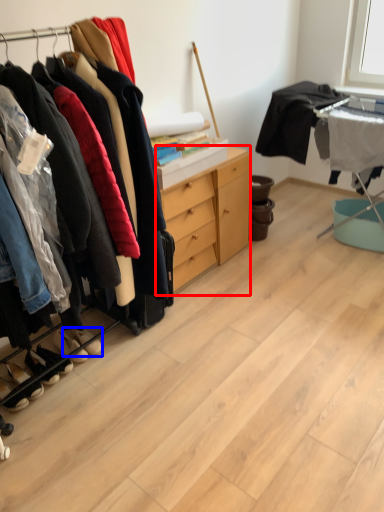
Question: Which point is closer to the camera, cabinetry (highlighted by a red box) or footwear (highlighted by a blue box)?

Choices:
 (A) cabinetry
 (B) footwear

Answer: (B)